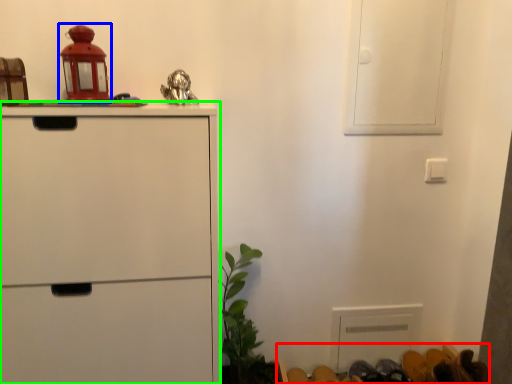
Question: Based on their relative distances, which object is nearer to furniture (highlighted by a red box)? Choose from toy (highlighted by a blue box) and chest of drawers (highlighted by a green box).

Choices:
 (A) toy
 (B) chest of drawers

Answer: (B)